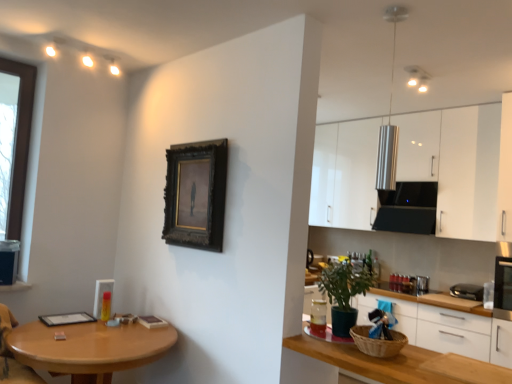
Question: From a real-world perspective, is white glossy cabinets at upper right, positioned as the second cabinetry in bottom-to-top order, on dark wood picture frame at center?

Choices:
 (A) yes
 (B) no

Answer: (A)

Question: Is white glossy cabinets at upper right, positioned as the second cabinetry in bottom-to-top order, thinner than dark wood picture frame at center?

Choices:
 (A) yes
 (B) no

Answer: (B)

Question: Is white glossy cabinets at upper right, positioned as the second cabinetry in bottom-to-top order, to the left of dark wood picture frame at center from the viewer's perspective?

Choices:
 (A) no
 (B) yes

Answer: (A)

Question: From a real-world perspective, does white glossy cabinets at upper right, positioned as the second cabinetry in bottom-to-top order, sit lower than dark wood picture frame at center?

Choices:
 (A) yes
 (B) no

Answer: (B)

Question: From the image's perspective, is white glossy cabinets at upper right, positioned as the second cabinetry in bottom-to-top order, beneath dark wood picture frame at center?

Choices:
 (A) no
 (B) yes

Answer: (A)

Question: From a real-world perspective, is dark wood picture frame at center physically located above or below wooden table at lower left?

Choices:
 (A) below
 (B) above

Answer: (B)

Question: Is dark wood picture frame at center inside the boundaries of wooden table at lower left, or outside?

Choices:
 (A) outside
 (B) inside

Answer: (A)

Question: Is dark wood picture frame at center in front of or behind wooden table at lower left in the image?

Choices:
 (A) front
 (B) behind

Answer: (B)

Question: Is dark wood picture frame at center wider or thinner than wooden table at lower left?

Choices:
 (A) wide
 (B) thin

Answer: (B)

Question: Is dark wood picture frame at center taller or shorter than green matte plant at lower right?

Choices:
 (A) tall
 (B) short

Answer: (A)

Question: Is dark wood picture frame at center spatially inside green matte plant at lower right, or outside of it?

Choices:
 (A) outside
 (B) inside

Answer: (A)

Question: From a real-world perspective, is dark wood picture frame at center above or below green matte plant at lower right?

Choices:
 (A) below
 (B) above

Answer: (B)

Question: Looking at the image, does dark wood picture frame at center seem bigger or smaller compared to green matte plant at lower right?

Choices:
 (A) big
 (B) small

Answer: (B)

Question: Which is correct: white glossy cabinets at right, which appears as the 2th cabinetry when viewed from the top, is inside green matte plant at lower right, or outside of it?

Choices:
 (A) inside
 (B) outside

Answer: (B)

Question: In the image, is white glossy cabinets at right, which is the first cabinetry in bottom-to-top order, positioned in front of or behind green matte plant at lower right?

Choices:
 (A) behind
 (B) front

Answer: (A)